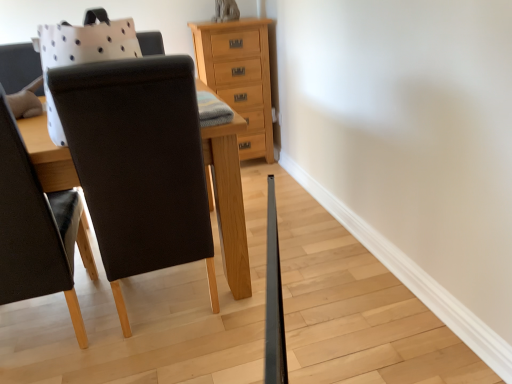
In order to click on free region under matte black chair at left (from a real-world perspective) in this screenshot , I will do `click(49, 334)`.